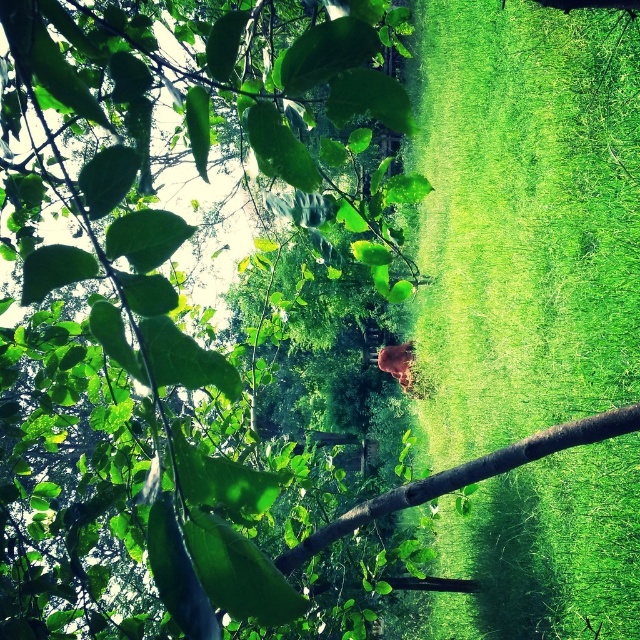
Question: Which object is closer to the camera taking this photo?

Choices:
 (A) green grass at center
 (B) brown rough tree branch at center

Answer: (B)

Question: Can you confirm if green grass at center is bigger than brown rough tree branch at center?

Choices:
 (A) no
 (B) yes

Answer: (B)

Question: Which of the following is the closest to the observer?

Choices:
 (A) (589, 420)
 (B) (532, 582)

Answer: (A)

Question: Is green grass at center smaller than brown rough tree branch at center?

Choices:
 (A) no
 (B) yes

Answer: (A)

Question: Can you confirm if green grass at center is positioned to the right of brown rough tree branch at center?

Choices:
 (A) no
 (B) yes

Answer: (B)